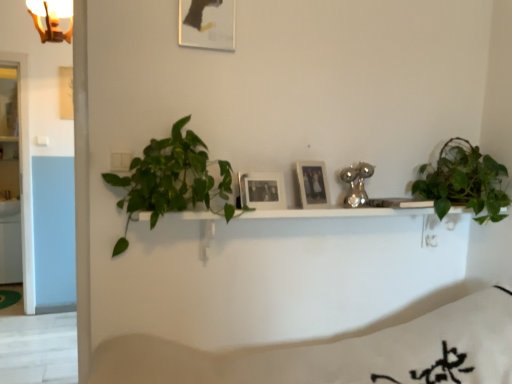
Question: From the image's perspective, does white matte bedding at lower center appear higher than gold metallic light fixture at upper left?

Choices:
 (A) no
 (B) yes

Answer: (A)

Question: Is white matte bedding at lower center at the left side of gold metallic light fixture at upper left?

Choices:
 (A) no
 (B) yes

Answer: (A)

Question: Are white matte bedding at lower center and gold metallic light fixture at upper left making contact?

Choices:
 (A) no
 (B) yes

Answer: (A)

Question: Is white matte bedding at lower center facing away from gold metallic light fixture at upper left?

Choices:
 (A) yes
 (B) no

Answer: (B)

Question: Does white matte bedding at lower center appear on the right side of gold metallic light fixture at upper left?

Choices:
 (A) yes
 (B) no

Answer: (A)

Question: Is white matte bedding at lower center surrounding gold metallic light fixture at upper left?

Choices:
 (A) no
 (B) yes

Answer: (A)

Question: Would you say gold metallic light fixture at upper left contains black matte picture frame at center, the 1th picture frame from the bottom?

Choices:
 (A) no
 (B) yes

Answer: (A)

Question: From the image's perspective, is gold metallic light fixture at upper left on black matte picture frame at center, which is counted as the 2th picture frame, starting from the right?

Choices:
 (A) no
 (B) yes

Answer: (B)

Question: Can you confirm if gold metallic light fixture at upper left is wider than black matte picture frame at center, the 1th picture frame from the bottom?

Choices:
 (A) yes
 (B) no

Answer: (A)

Question: Can you confirm if gold metallic light fixture at upper left is smaller than black matte picture frame at center, the 3th picture frame when ordered from top to bottom?

Choices:
 (A) yes
 (B) no

Answer: (B)

Question: From the image's perspective, is gold metallic light fixture at upper left beneath black matte picture frame at center, the 1th picture frame from the bottom?

Choices:
 (A) no
 (B) yes

Answer: (A)

Question: Is the position of gold metallic light fixture at upper left less distant than that of black matte picture frame at center, the 3th picture frame when ordered from top to bottom?

Choices:
 (A) no
 (B) yes

Answer: (A)

Question: Is green matte plant at upper right, placed as the 2th houseplant when sorted from left to right, at the back of matte black picture frame at upper center, marked as the third picture frame in a right-to-left arrangement?

Choices:
 (A) yes
 (B) no

Answer: (B)